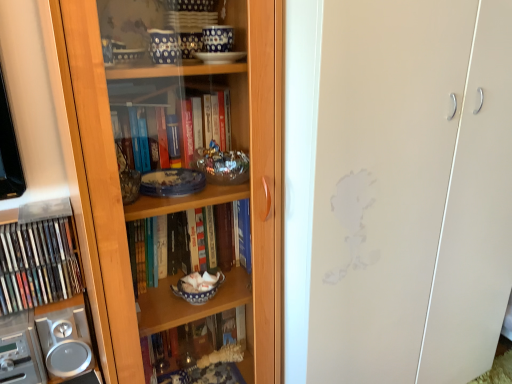
This screenshot has height=384, width=512. What are the coordinates of `matte plastic books at left` in the screenshot? It's located at (38, 264).

I want to click on silver metallic speaker at lower left, so click(x=42, y=299).

Image resolution: width=512 pixels, height=384 pixels. Describe the element at coordinates (148, 158) in the screenshot. I see `wooden bookcase at left` at that location.

You are a GUI agent. You are given a task and a screenshot of the screen. Output one action in this format:
    pyautogui.click(x=<x>, y=<y>)
    Task: Click on the matte plastic books at left
    Image resolution: width=512 pixels, height=384 pixels.
    Given the screenshot: What is the action you would take?
    pyautogui.click(x=38, y=264)

Which object is closer to the camera, transparent glass cabinet at center or silver metallic speaker at lower left?

transparent glass cabinet at center is closer to the camera.

Is transparent glass cabinet at center looking in the opposite direction of silver metallic speaker at lower left?

No.

Is transparent glass cabinet at center completely or partially outside of silver metallic speaker at lower left?

Yes.

Which is nearer, (413,105) or (54,301)?

The point (413,105) is closer to the camera.

Is wooden bookcase at left not near transparent glass cabinet at center?

No, wooden bookcase at left is not far away from transparent glass cabinet at center.

Considering the sizes of wooden bookcase at left and transparent glass cabinet at center in the image, is wooden bookcase at left wider or thinner than transparent glass cabinet at center?

Considering their sizes, wooden bookcase at left looks slimmer than transparent glass cabinet at center.

Is wooden bookcase at left oriented towards transparent glass cabinet at center?

No, wooden bookcase at left is not facing towards transparent glass cabinet at center.

Between wooden bookcase at left and transparent glass cabinet at center, which one appears on the right side from the viewer's perspective?

Positioned to the right is transparent glass cabinet at center.

Which object is wider, wooden bookcase at left or silver metallic speaker at lower left?

wooden bookcase at left.

Does wooden bookcase at left have a larger size compared to silver metallic speaker at lower left?

Indeed, wooden bookcase at left has a larger size compared to silver metallic speaker at lower left.

The height and width of the screenshot is (384, 512). In order to click on bookcase above the silver metallic speaker at lower left (from the image's perspective) in this screenshot , I will do point(148,158).

Consider the image. From a real-world perspective, which object stands above the other?

wooden bookcase at left.

Is matte plastic books at left smaller than wooden bookcase at left?

Yes.

From the image's perspective, does matte plastic books at left appear lower than wooden bookcase at left?

Indeed, from the image's perspective, matte plastic books at left is shown beneath wooden bookcase at left.

You are a GUI agent. You are given a task and a screenshot of the screen. Output one action in this format:
    pyautogui.click(x=<x>, y=<y>)
    Task: Click on the book located on the left of wooden bookcase at left
    
    Given the screenshot: What is the action you would take?
    click(38, 264)

Considering the relative positions of matte plastic books at left and wooden bookcase at left in the image provided, is matte plastic books at left to the right of wooden bookcase at left from the viewer's perspective?

Incorrect, matte plastic books at left is not on the right side of wooden bookcase at left.

Consider the image. Is wooden bookcase at left facing away from matte plastic books at left?

No, matte plastic books at left is not at the back of wooden bookcase at left.

Which object is further away from the camera, wooden bookcase at left or matte plastic books at left?

matte plastic books at left is further away from the camera.

Does wooden bookcase at left have a lesser height compared to matte plastic books at left?

No.

In terms of size, does wooden bookcase at left appear bigger or smaller than matte plastic books at left?

Clearly, wooden bookcase at left is larger in size than matte plastic books at left.

Which object is positioned more to the left, silver metallic speaker at lower left or wooden bookcase at left?

From the viewer's perspective, silver metallic speaker at lower left appears more on the left side.

Does point (31, 332) come farther from viewer compared to point (264, 190)?

Yes, it is.

Does silver metallic speaker at lower left have a lesser width compared to wooden bookcase at left?

Yes.

This screenshot has width=512, height=384. In order to click on cabinet that appears behind the wooden bookcase at left in this screenshot , I will do `click(42, 299)`.

From a real-world perspective, is transparent glass cabinet at center above or below wooden bookcase at left?

transparent glass cabinet at center is above wooden bookcase at left.

Which object is more forward, transparent glass cabinet at center or wooden bookcase at left?

wooden bookcase at left.

Can you confirm if transparent glass cabinet at center is thinner than wooden bookcase at left?

No.

Locate an element on the screen. The height and width of the screenshot is (384, 512). cabinet behind the transparent glass cabinet at center is located at coordinates (42, 299).

Locate an element on the screen. bookcase to the left of transparent glass cabinet at center is located at coordinates (148, 158).

Based on their spatial positions, is matte plastic books at left or silver metallic speaker at lower left further from wooden bookcase at left?

The object further to wooden bookcase at left is matte plastic books at left.

Which object lies nearer to the anchor point silver metallic speaker at lower left, matte plastic books at left or wooden bookcase at left?

matte plastic books at left is closer to silver metallic speaker at lower left.

When comparing their distances from transparent glass cabinet at center, does silver metallic speaker at lower left or wooden bookcase at left seem closer?

wooden bookcase at left lies closer to transparent glass cabinet at center than the other object.

Which object lies further to the anchor point matte plastic books at left, wooden bookcase at left or silver metallic speaker at lower left?

wooden bookcase at left.

From the image, which object appears to be farther from wooden bookcase at left, transparent glass cabinet at center or silver metallic speaker at lower left?

Among the two, silver metallic speaker at lower left is located further to wooden bookcase at left.

When comparing their distances from transparent glass cabinet at center, does wooden bookcase at left or matte plastic books at left seem closer?

wooden bookcase at left.

Considering their positions, is wooden bookcase at left positioned further to silver metallic speaker at lower left than transparent glass cabinet at center?

Based on the image, transparent glass cabinet at center appears to be further to silver metallic speaker at lower left.

In the scene shown: Considering their positions, is transparent glass cabinet at center positioned closer to wooden bookcase at left than matte plastic books at left?

transparent glass cabinet at center is positioned closer to the anchor wooden bookcase at left.

Locate an element on the screen. This screenshot has height=384, width=512. bookcase situated between matte plastic books at left and transparent glass cabinet at center from left to right is located at coordinates (148, 158).

This screenshot has height=384, width=512. I want to click on bookcase between silver metallic speaker at lower left and transparent glass cabinet at center from left to right, so click(x=148, y=158).

Locate an element on the screen. cabinet situated between matte plastic books at left and wooden bookcase at left from left to right is located at coordinates (42, 299).

Where is `cabinet situated between matte plastic books at left and transparent glass cabinet at center from left to right`? Image resolution: width=512 pixels, height=384 pixels. cabinet situated between matte plastic books at left and transparent glass cabinet at center from left to right is located at coordinates (42, 299).